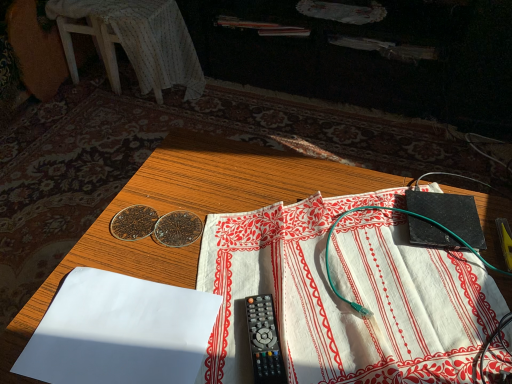
At what (x,y) coordinates should I click in order to perform the action: click on free spot below white cloth at center, which is counted as the second sheet, starting from the left (from a real-world perspective). Please return your answer as a coordinate pair (x, y). Looking at the image, I should click on (366, 282).